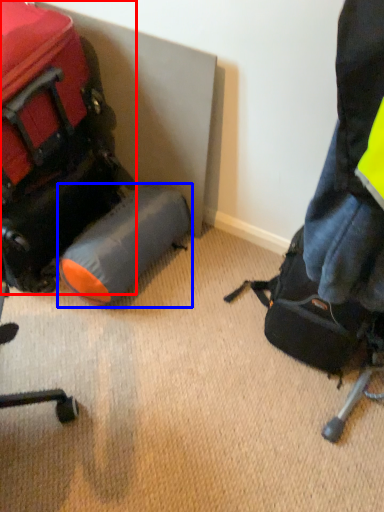
Question: Which object appears closest to the camera in this image, luggage and bags (highlighted by a red box) or luggage (highlighted by a blue box)?

Choices:
 (A) luggage and bags
 (B) luggage

Answer: (A)